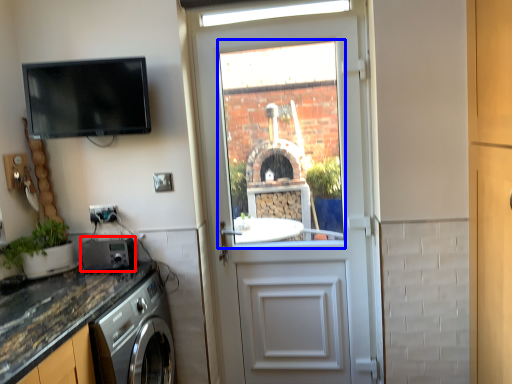
Question: Which of the following is the closest to the observer, appliance (highlighted by a red box) or window (highlighted by a blue box)?

Choices:
 (A) appliance
 (B) window

Answer: (A)